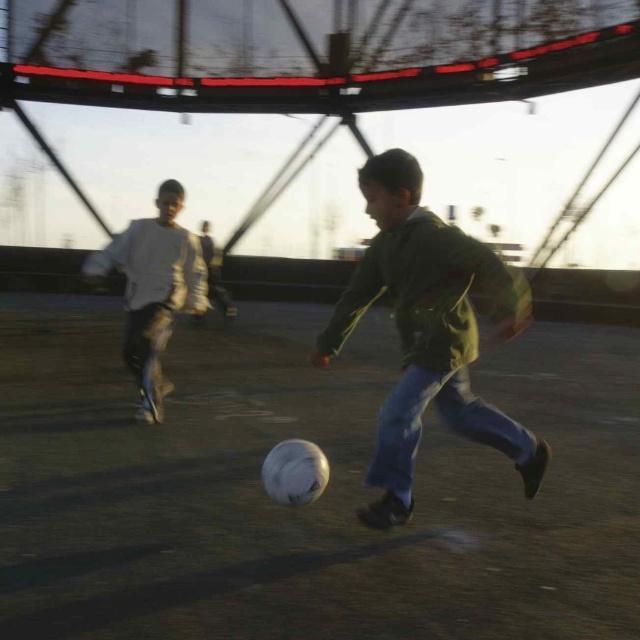
You are a photographer trying to capture a photo of the two children playing soccer. You want to ensure that both the green matte jacket at center and the white matte shirt at left are clearly visible in the frame. Given their sizes, which child should you focus on first to ensure proper focus?

The green matte jacket at center is taller than the white matte shirt at left, so you should focus on the green matte jacket at center first to ensure proper focus since it is larger and more prominent in the frame.

You are a photographer trying to capture a closeup shot of the green matte jacket at center and the white matte shirt at left. Which one should you zoom in on more to ensure both are in focus?

The green matte jacket at center is larger in size than the white matte shirt at left, so you should zoom in more on the white matte shirt at left to ensure both are in focus.